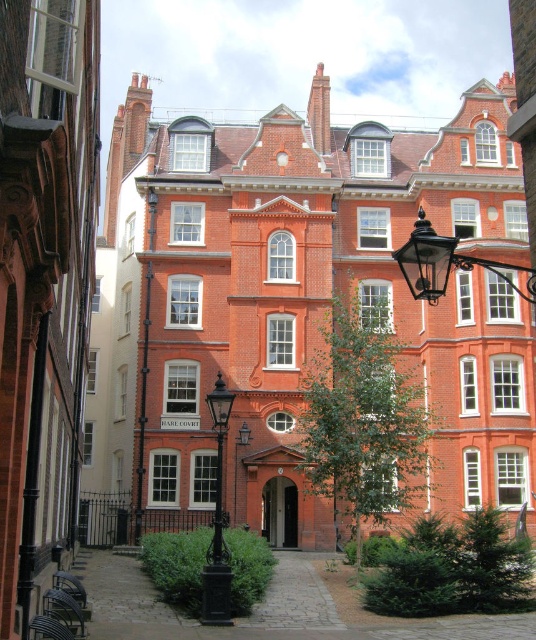
Is point (430, 243) farther from camera compared to point (210, 602)?

That is False.

Is black wrought iron streetlight at upper right behind black wrought iron lamp post at center?

No, black wrought iron streetlight at upper right is closer to the viewer.

You are a GUI agent. You are given a task and a screenshot of the screen. Output one action in this format:
    pyautogui.click(x=<x>, y=<y>)
    Task: Click on the black wrought iron streetlight at upper right
    Image resolution: width=536 pixels, height=640 pixels.
    Given the screenshot: What is the action you would take?
    pyautogui.click(x=444, y=262)